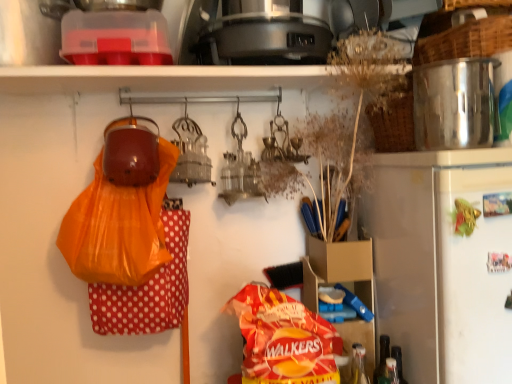
Question: Can you confirm if red matte bag of walkers chips at center is taller than translucent plastic bottle at lower right, acting as the second bottle starting from the left?

Choices:
 (A) yes
 (B) no

Answer: (A)

Question: From the image's perspective, is red matte bag of walkers chips at center over translucent plastic bottle at lower right, the first bottle when ordered from right to left?

Choices:
 (A) yes
 (B) no

Answer: (A)

Question: Is red matte bag of walkers chips at center bigger than translucent plastic bottle at lower right, the first bottle when ordered from right to left?

Choices:
 (A) yes
 (B) no

Answer: (A)

Question: Is red matte bag of walkers chips at center at the right side of translucent plastic bottle at lower right, the first bottle when ordered from right to left?

Choices:
 (A) no
 (B) yes

Answer: (A)

Question: Does red matte bag of walkers chips at center have a lesser height compared to translucent plastic bottle at lower right, the first bottle when ordered from right to left?

Choices:
 (A) no
 (B) yes

Answer: (A)

Question: Can you confirm if red matte bag of walkers chips at center is positioned to the left of translucent plastic bottle at lower right, the first bottle when ordered from right to left?

Choices:
 (A) yes
 (B) no

Answer: (A)

Question: Considering the relative sizes of translucent plastic bottle at lower right, acting as the first bottle starting from the left, and orange plastic bag at left in the image provided, is translucent plastic bottle at lower right, acting as the first bottle starting from the left, bigger than orange plastic bag at left?

Choices:
 (A) no
 (B) yes

Answer: (A)

Question: From the image's perspective, is translucent plastic bottle at lower right, placed as the second bottle when sorted from right to left, beneath orange plastic bag at left?

Choices:
 (A) no
 (B) yes

Answer: (B)

Question: Does translucent plastic bottle at lower right, acting as the first bottle starting from the left, touch orange plastic bag at left?

Choices:
 (A) no
 (B) yes

Answer: (A)

Question: From a real-world perspective, is translucent plastic bottle at lower right, placed as the second bottle when sorted from right to left, physically below orange plastic bag at left?

Choices:
 (A) yes
 (B) no

Answer: (A)

Question: Does translucent plastic bottle at lower right, placed as the second bottle when sorted from right to left, have a lesser width compared to orange plastic bag at left?

Choices:
 (A) yes
 (B) no

Answer: (A)

Question: Is translucent plastic bottle at lower right, placed as the second bottle when sorted from right to left, at the left side of orange plastic bag at left?

Choices:
 (A) yes
 (B) no

Answer: (B)

Question: Is red matte bag of walkers chips at center taller than satin silver refrigerator at right?

Choices:
 (A) no
 (B) yes

Answer: (A)